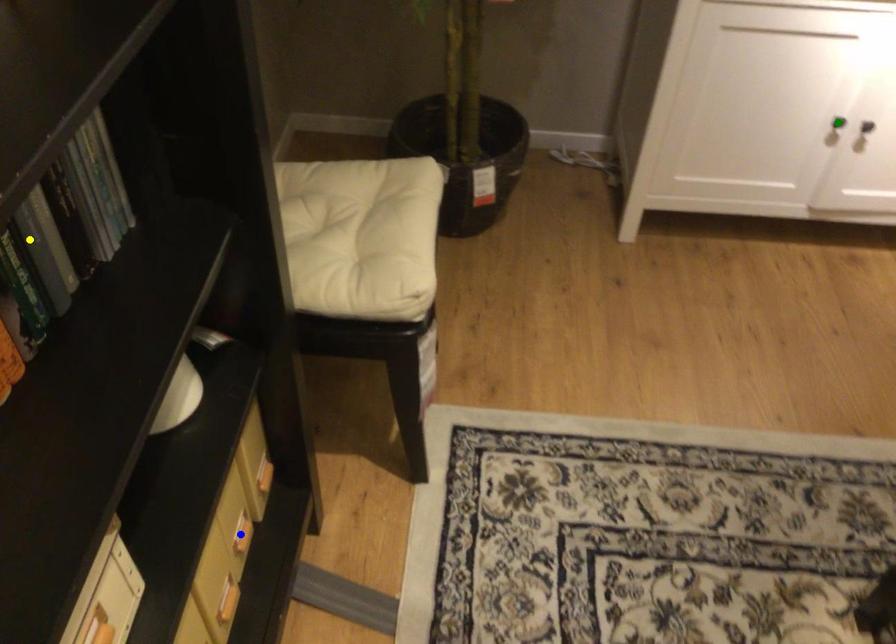
Order these from nearest to farthest:
green point, blue point, yellow point

1. yellow point
2. blue point
3. green point